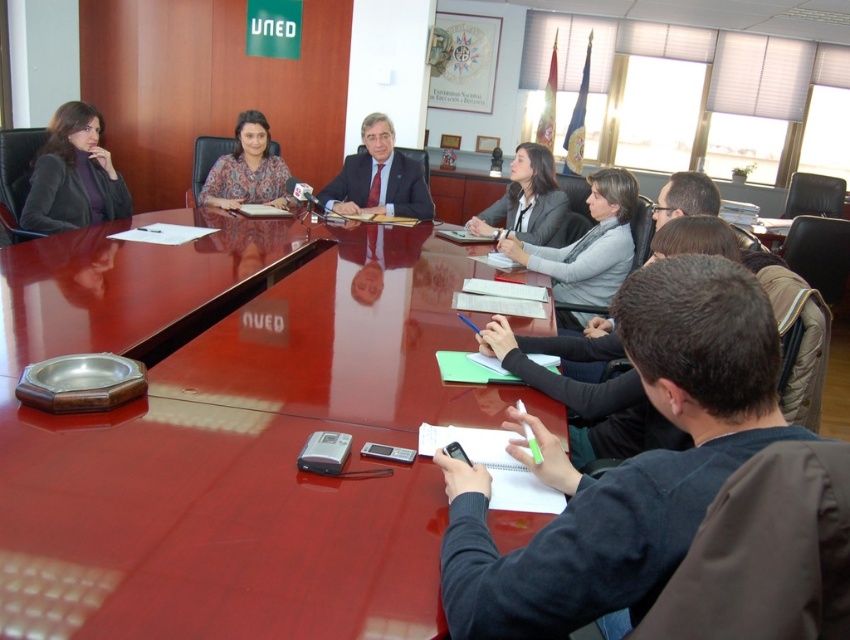
Which is above, glossy wood table at center or matte black suit at center?

matte black suit at center

Is point (207, 324) farther from viewer compared to point (416, 189)?

No, (207, 324) is in front of (416, 189).

Locate an element on the screen. glossy wood table at center is located at coordinates (231, 433).

Who is lower down, dark blue sweater at center or matte black jacket at left?

dark blue sweater at center is below.

Is dark blue sweater at center positioned in front of matte black jacket at left?

That is True.

This screenshot has width=850, height=640. I want to click on dark blue sweater at center, so point(625,465).

This screenshot has width=850, height=640. I want to click on dark blue sweater at center, so click(x=625, y=465).

Can you confirm if matte gray blazer at upper center is positioned below patterned fabric blouse at center?

Correct, matte gray blazer at upper center is located below patterned fabric blouse at center.

Based on the photo, who is lower down, matte gray blazer at upper center or patterned fabric blouse at center?

matte gray blazer at upper center

Image resolution: width=850 pixels, height=640 pixels. What are the coordinates of `matte gray blazer at upper center` in the screenshot? It's located at coord(525,198).

Where is `matte gray blazer at upper center`? This screenshot has height=640, width=850. matte gray blazer at upper center is located at coordinates (525, 198).